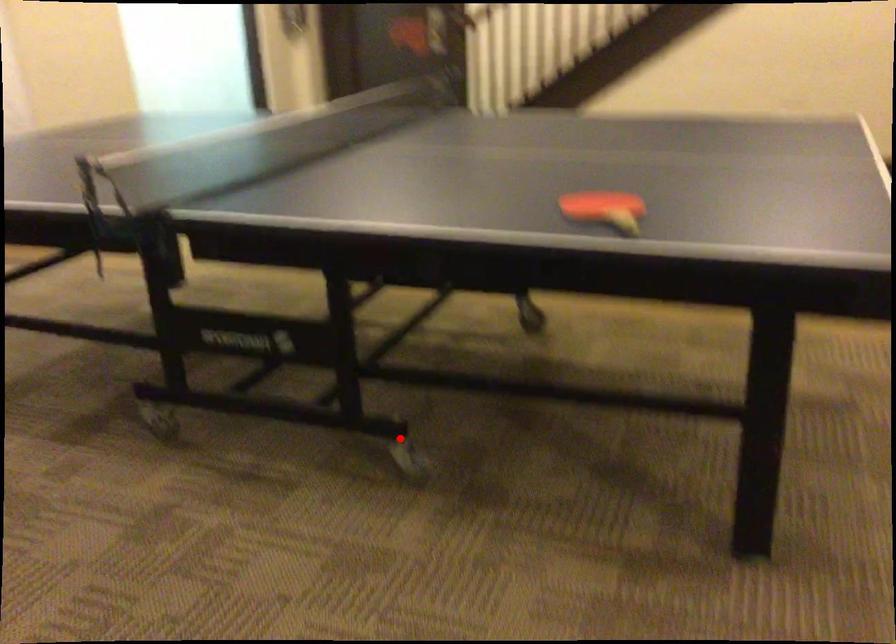
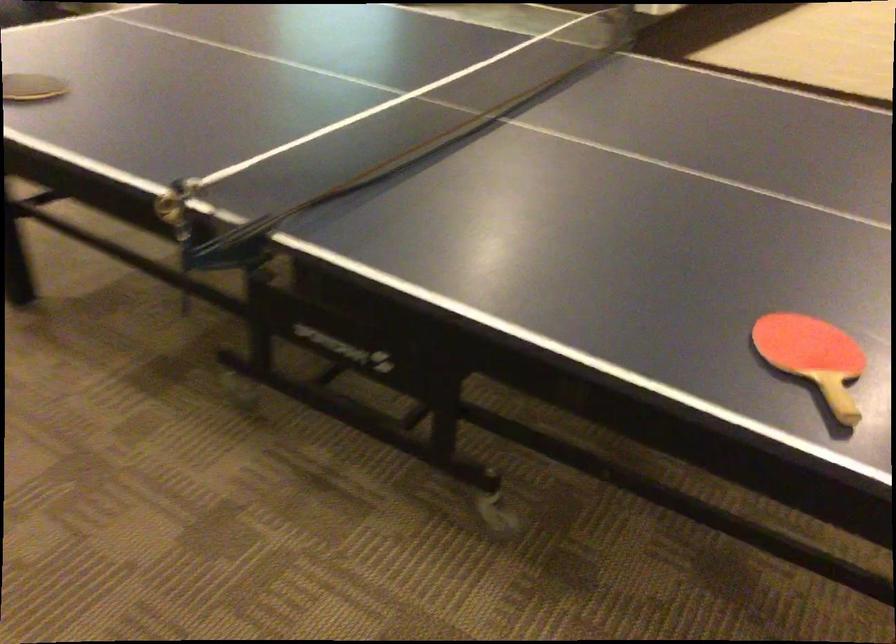
Question: I am providing you with two images of the same scene from different viewpoints. Given a red point in image1, look at the same physical point in image2. Is it:

Choices:
 (A) Closer to the viewpoint
 (B) Farther from the viewpoint

Answer: (A)